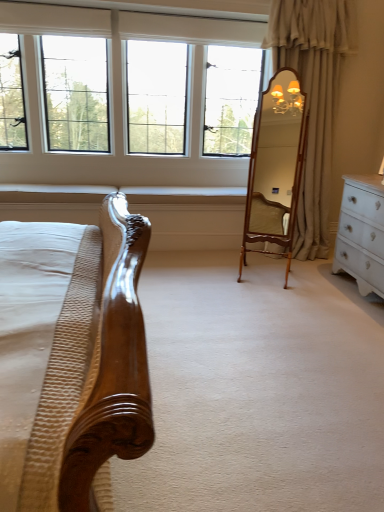
Question: Which is correct: beige fabric curtain at right is inside wooden mirror at center, or outside of it?

Choices:
 (A) outside
 (B) inside

Answer: (A)

Question: Considering their positions, is beige fabric curtain at right located in front of or behind wooden mirror at center?

Choices:
 (A) front
 (B) behind

Answer: (B)

Question: Estimate the real-world distances between objects in this image. Which object is closer to the beige fabric curtain at right?

Choices:
 (A) wooden mirror at center
 (B) clear glass windows at upper center

Answer: (A)

Question: Which of these objects is positioned closest to the wooden mirror at center?

Choices:
 (A) clear glass windows at upper center
 (B) beige fabric curtain at right

Answer: (B)